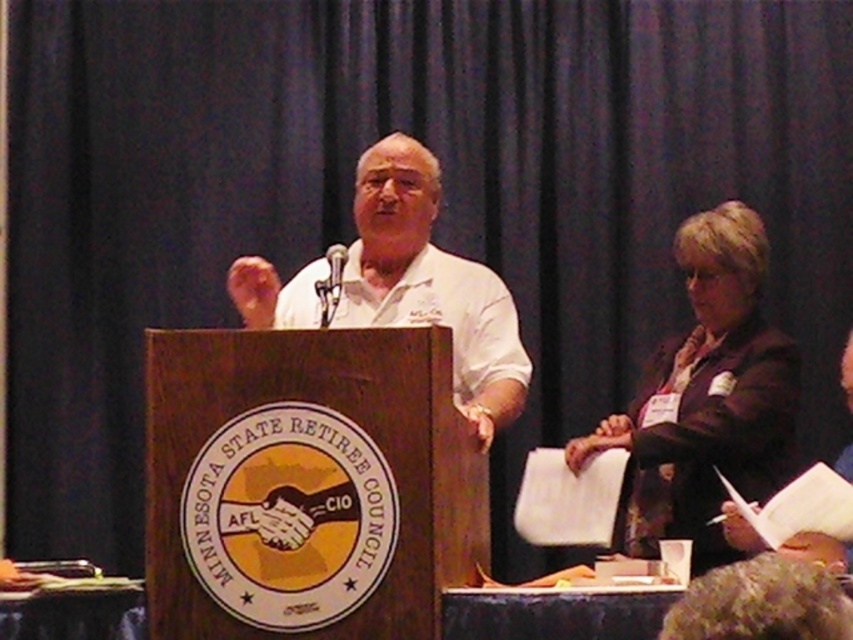
You are organizing a formal event and need to ensure that the attire of the speakers aligns with the theme. Given the dark brown suit at right and the white matte shirt at center, which one is narrower in width?

The dark brown suit at right is narrower in width than the white matte shirt at center.

You are an event organizer and need to determine seating arrangements based on the attendees visible in the scene. The dark brown suit at right and the white matte shirt at center are present. Which attendee should be seated closer to the front of the room based on their position in the image?

The white matte shirt at center should be seated closer to the front since it occupies more space than the dark brown suit at right, indicating a more prominent position.

You are attending a formal event and notice two people on stage. One is wearing a dark brown suit at right and the other a white matte shirt at center. From your perspective as an audience member, which person is standing to the right of the other?

The dark brown suit at right is positioned on the right side of white matte shirt at center, so the person in the dark brown suit at right is to the right of the person in the white matte shirt at center.